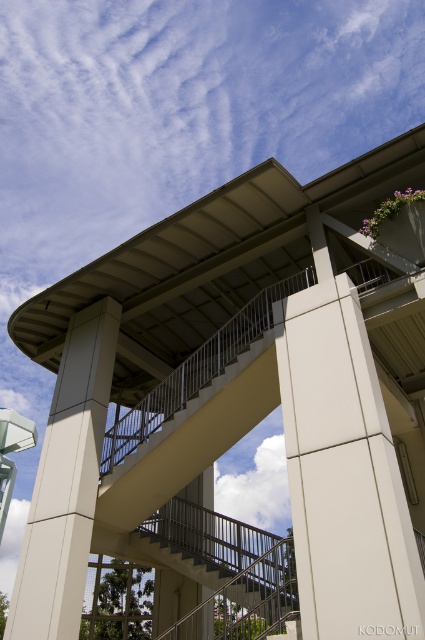
Question: Which object appears closest to the camera in this image?

Choices:
 (A) white smooth pillar at center
 (B) metallic gray staircase at center

Answer: (A)

Question: Which object appears closest to the camera in this image?

Choices:
 (A) white smooth pillar at center
 (B) beige concrete pillar at center

Answer: (A)

Question: Is white smooth pillar at center below beige concrete pillar at center?

Choices:
 (A) no
 (B) yes

Answer: (A)

Question: Which object is the closest to the metallic gray staircase at center?

Choices:
 (A) white smooth pillar at center
 (B) beige concrete pillar at center

Answer: (A)

Question: From the image, what is the correct spatial relationship of white smooth pillar at center in relation to beige concrete pillar at center?

Choices:
 (A) above
 (B) below

Answer: (A)

Question: Does beige concrete pillar at center come in front of metallic gray staircase at center?

Choices:
 (A) no
 (B) yes

Answer: (B)